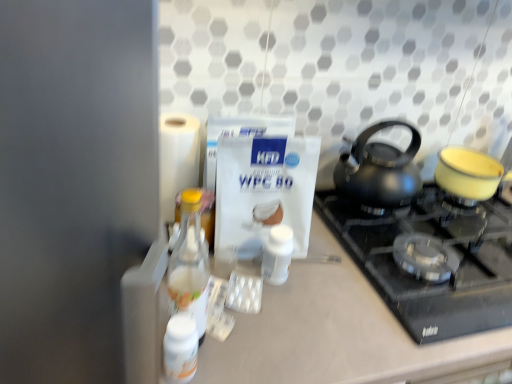
You are a GUI agent. You are given a task and a screenshot of the screen. Output one action in this format:
    pyautogui.click(x=<x>, y=<y>)
    Task: Click on the vacant area in front of white matte bottle at center, the 3th bottle viewed from the front
    The width and height of the screenshot is (512, 384).
    Given the screenshot: What is the action you would take?
    pyautogui.click(x=278, y=330)